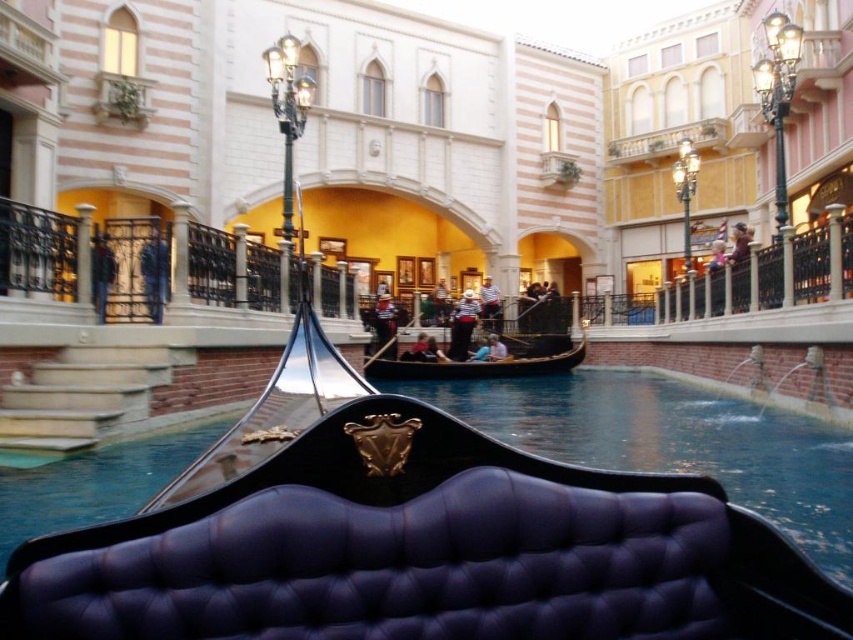
Question: In this image, where is glossy black gondola at center located relative to black polished wood gondola at center?

Choices:
 (A) above
 (B) below

Answer: (A)

Question: Which object is the farthest from the black polished wood gondola at center?

Choices:
 (A) glossy black gondola at center
 (B) black wrought iron railing at upper center

Answer: (A)

Question: Does glossy black gondola at center lie behind black polished wood gondola at center?

Choices:
 (A) no
 (B) yes

Answer: (A)

Question: Among these points, which one is nearest to the camera?

Choices:
 (A) (125, 321)
 (B) (326, 467)
 (C) (389, 378)

Answer: (B)

Question: Can you confirm if glossy black gondola at center is thinner than black polished wood gondola at center?

Choices:
 (A) no
 (B) yes

Answer: (B)

Question: Which point appears closest to the camera in this image?

Choices:
 (A) (30, 269)
 (B) (606, 637)

Answer: (B)